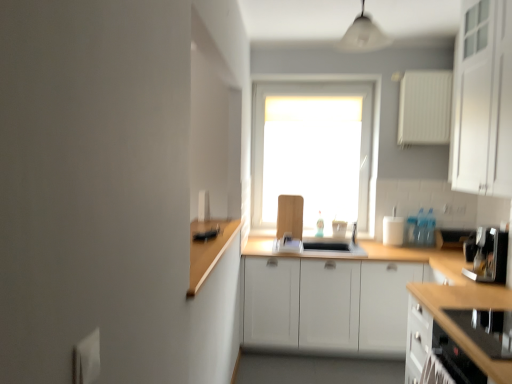
Question: From a real-world perspective, is wooden at center physically below black glass stovetop at lower right, the 2th cabinetry when ordered from top to bottom?

Choices:
 (A) yes
 (B) no

Answer: (A)

Question: From a real-world perspective, is wooden at center located higher than black glass stovetop at lower right, marked as the first cabinetry in a bottom-to-top arrangement?

Choices:
 (A) no
 (B) yes

Answer: (A)

Question: Does wooden at center have a greater height compared to black glass stovetop at lower right, the 2th cabinetry when ordered from top to bottom?

Choices:
 (A) no
 (B) yes

Answer: (B)

Question: Is wooden at center to the right of black glass stovetop at lower right, marked as the first cabinetry in a bottom-to-top arrangement, from the viewer's perspective?

Choices:
 (A) yes
 (B) no

Answer: (B)

Question: Is wooden at center to the left of black glass stovetop at lower right, marked as the first cabinetry in a bottom-to-top arrangement, from the viewer's perspective?

Choices:
 (A) no
 (B) yes

Answer: (B)

Question: Is wooden at center not within black glass stovetop at lower right, marked as the first cabinetry in a bottom-to-top arrangement?

Choices:
 (A) no
 (B) yes

Answer: (B)

Question: From a real-world perspective, is white matte window at center on top of wooden cutting board at center, the 4th appliance from the right?

Choices:
 (A) no
 (B) yes

Answer: (B)

Question: Is white matte window at center shorter than wooden cutting board at center, the first appliance positioned from the left?

Choices:
 (A) yes
 (B) no

Answer: (B)

Question: Can you confirm if white matte window at center is thinner than wooden cutting board at center, the first appliance positioned from the left?

Choices:
 (A) no
 (B) yes

Answer: (A)

Question: Does white matte window at center have a smaller size compared to wooden cutting board at center, the first appliance positioned from the left?

Choices:
 (A) yes
 (B) no

Answer: (B)

Question: Can you see white matte window at center touching wooden cutting board at center, which ranks as the 3th appliance in bottom-to-top order?

Choices:
 (A) yes
 (B) no

Answer: (B)

Question: Considering the relative positions of white matte window at center and wooden cutting board at center, which is counted as the 1th appliance, starting from the back, in the image provided, is white matte window at center in front of wooden cutting board at center, which is counted as the 1th appliance, starting from the back,?

Choices:
 (A) no
 (B) yes

Answer: (A)

Question: Can you confirm if white matte cabinet at upper right, which ranks as the first cabinetry in top-to-bottom order, is bigger than white matte window at center?

Choices:
 (A) yes
 (B) no

Answer: (A)